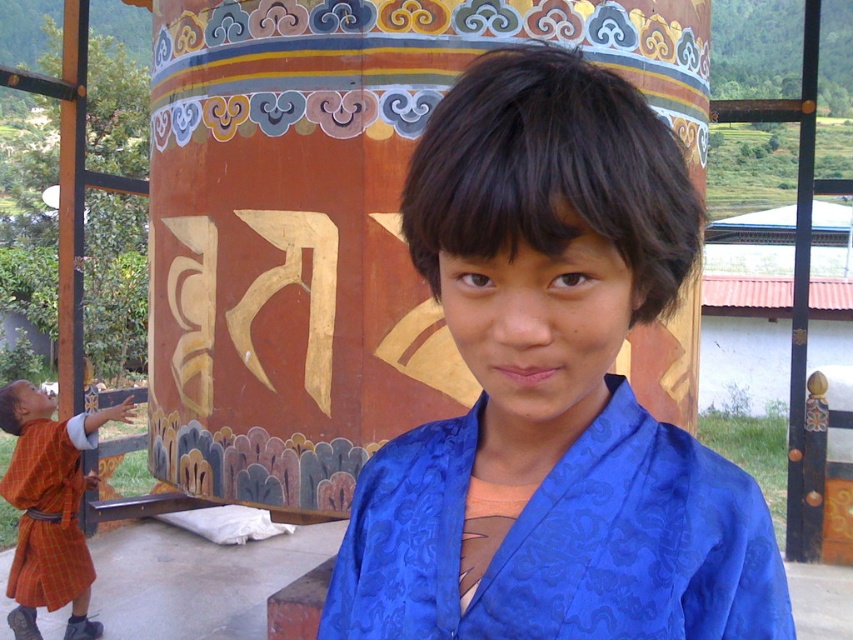
Question: Does blue satin robe at center come behind orange plaid robe at lower left?

Choices:
 (A) no
 (B) yes

Answer: (A)

Question: Does blue satin robe at center appear over orange plaid robe at lower left?

Choices:
 (A) no
 (B) yes

Answer: (B)

Question: Which point is farther to the camera?

Choices:
 (A) (447, 531)
 (B) (12, 572)
 (C) (608, 420)

Answer: (B)

Question: Is blue satin robe at center smaller than orange plaid robe at lower left?

Choices:
 (A) yes
 (B) no

Answer: (A)

Question: Among these points, which one is nearest to the camera?

Choices:
 (A) (28, 404)
 (B) (659, 275)

Answer: (B)

Question: Which is nearer to the orange plaid robe at lower left?

Choices:
 (A) blue satin robe at center
 (B) blue silk kimono at center

Answer: (A)